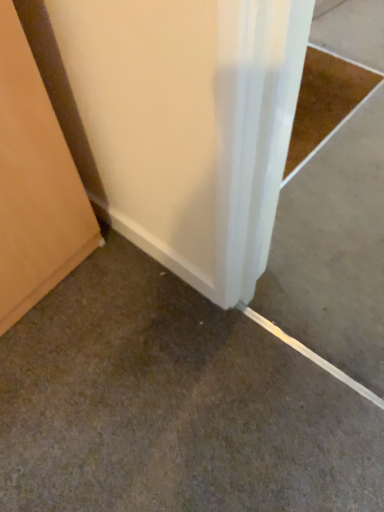
Locate an element on the screen. The image size is (384, 512). gray matte concrete at center is located at coordinates (172, 405).

What is the approximate width of gray matte concrete at center?

gray matte concrete at center is 75.10 centimeters wide.

This screenshot has height=512, width=384. What do you see at coordinates (172, 405) in the screenshot?
I see `gray matte concrete at center` at bounding box center [172, 405].

Find the location of a particular element. This screenshot has height=512, width=384. gray matte concrete at center is located at coordinates coord(172,405).